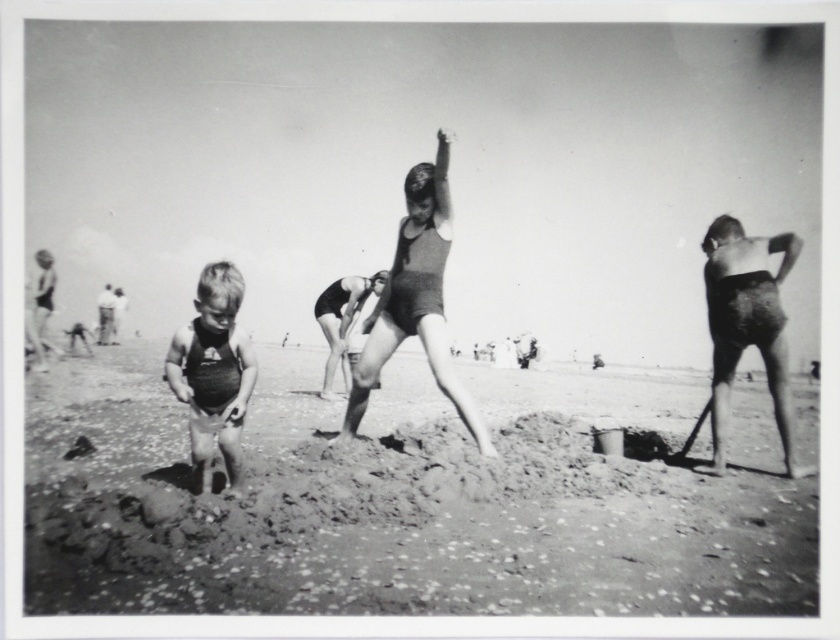
You are a photographer analyzing this black and white photo. You notice the smooth sand at center and the dark swimsuit at center. Based on their positions, which object is lower in the image?

The smooth sand at center is located below dark swimsuit at center, so the smooth sand at center is lower in the image.

Looking at the black and white beach photo, you notice the smooth sand at center and the dark swimsuit at center. Which of these two items takes up more horizontal space in the image?

The smooth sand at center takes up more horizontal space than the dark swimsuit at center because its width is larger.